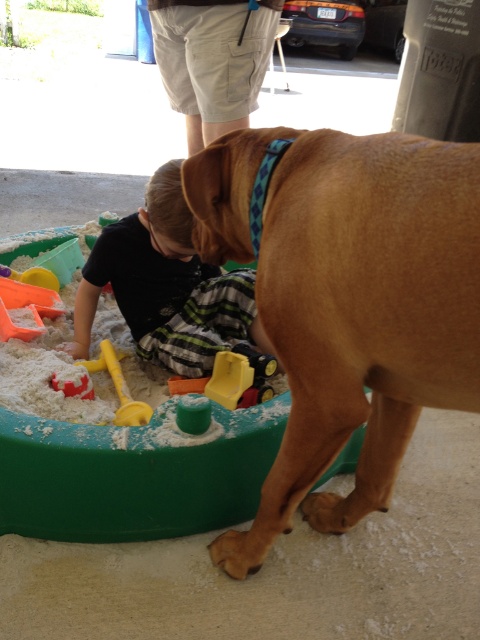
Question: Which object is farther from the camera taking this photo?

Choices:
 (A) black cotton shirt at lower left
 (B) red plastic shovel at lower left
 (C) golden fur dog at right
 (D) yellow plastic shovel at lower left

Answer: (B)

Question: Which point is closer to the camera taking this photo?

Choices:
 (A) (387, 504)
 (B) (119, 385)

Answer: (A)

Question: Can you confirm if golden fur dog at right is positioned to the right of red plastic shovel at lower left?

Choices:
 (A) no
 (B) yes

Answer: (B)

Question: Is the position of golden fur dog at right less distant than that of yellow plastic shovel at lower left?

Choices:
 (A) yes
 (B) no

Answer: (A)

Question: Which object is positioned farthest from the golden fur dog at right?

Choices:
 (A) red plastic shovel at lower left
 (B) yellow plastic shovel at lower left

Answer: (A)

Question: Is golden fur dog at right smaller than red plastic shovel at lower left?

Choices:
 (A) no
 (B) yes

Answer: (A)